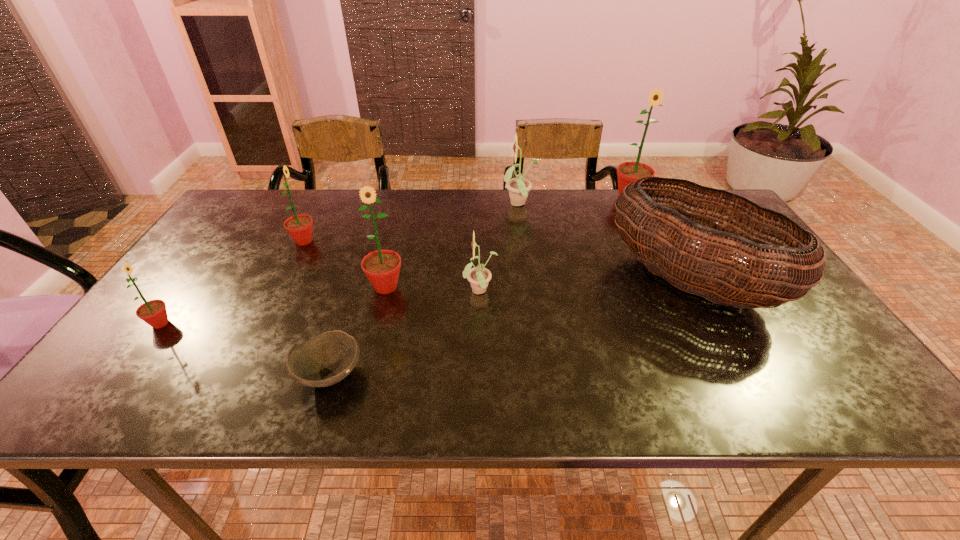
What are the coordinates of `free region at the far edge of the desktop` in the screenshot? It's located at (588, 215).

The height and width of the screenshot is (540, 960). Identify the location of vacant region at the near edge of the desktop. (765, 376).

Locate an element on the screen. Image resolution: width=960 pixels, height=540 pixels. free space at the left edge is located at coordinates (241, 252).

Where is `vacant area at the right edge`? vacant area at the right edge is located at coordinates (818, 321).

Identify the location of vacant space at the far left corner of the desktop. (275, 197).

The image size is (960, 540). What are the coordinates of `free spot between the smallest green sunflower and the farther yellow sunflower` in the screenshot? It's located at (340, 264).

At what (x,y) coordinates should I click in order to perform the action: click on free space between the right yellow sunflower and the bowl. Please return your answer as a coordinate pair (x, y). This screenshot has width=960, height=540. Looking at the image, I should click on (424, 289).

You are a GUI agent. You are given a task and a screenshot of the screen. Output one action in this format:
    pyautogui.click(x=<x>, y=<y>)
    Task: Click on the free space between the nearest sunflower and the fourth nearest sunflower
    
    Given the screenshot: What is the action you would take?
    pyautogui.click(x=232, y=282)

Locate an element on the screen. vacant space that's between the second green sunflower from right to left and the leftmost object is located at coordinates [273, 305].

The width and height of the screenshot is (960, 540). I want to click on free space that is in between the right yellow sunflower and the basket, so click(x=605, y=243).